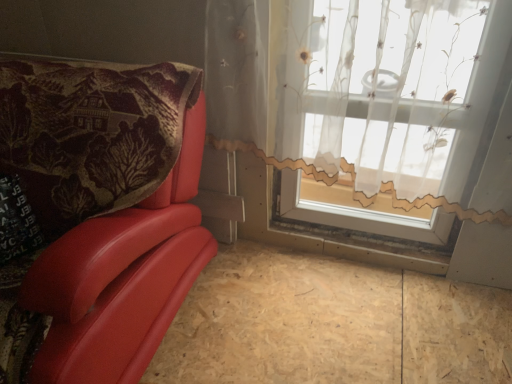
Question: Is matte red leather chair at left positioned beyond the bounds of translucent floral-patterned curtain at upper right?

Choices:
 (A) no
 (B) yes

Answer: (B)

Question: Does matte red leather chair at left lie behind translucent floral-patterned curtain at upper right?

Choices:
 (A) no
 (B) yes

Answer: (A)

Question: Does matte red leather chair at left have a greater height compared to translucent floral-patterned curtain at upper right?

Choices:
 (A) no
 (B) yes

Answer: (A)

Question: Does matte red leather chair at left appear on the right side of translucent floral-patterned curtain at upper right?

Choices:
 (A) yes
 (B) no

Answer: (B)

Question: Is translucent floral-patterned curtain at upper right located within matte red leather chair at left?

Choices:
 (A) yes
 (B) no

Answer: (B)

Question: Considering the relative sizes of matte red leather chair at left and translucent floral-patterned curtain at upper right in the image provided, is matte red leather chair at left shorter than translucent floral-patterned curtain at upper right?

Choices:
 (A) yes
 (B) no

Answer: (A)

Question: Is plywood at lower left not near matte red leather chair at left?

Choices:
 (A) yes
 (B) no

Answer: (B)

Question: Is plywood at lower left further to camera compared to matte red leather chair at left?

Choices:
 (A) no
 (B) yes

Answer: (B)

Question: From the image's perspective, is plywood at lower left above matte red leather chair at left?

Choices:
 (A) yes
 (B) no

Answer: (B)

Question: Is plywood at lower left aimed at matte red leather chair at left?

Choices:
 (A) no
 (B) yes

Answer: (A)

Question: Considering the relative sizes of plywood at lower left and matte red leather chair at left in the image provided, is plywood at lower left shorter than matte red leather chair at left?

Choices:
 (A) no
 (B) yes

Answer: (B)

Question: From the image's perspective, does plywood at lower left appear lower than matte red leather chair at left?

Choices:
 (A) no
 (B) yes

Answer: (B)

Question: Does translucent floral-patterned curtain at upper right have a larger size compared to plywood at lower left?

Choices:
 (A) no
 (B) yes

Answer: (B)